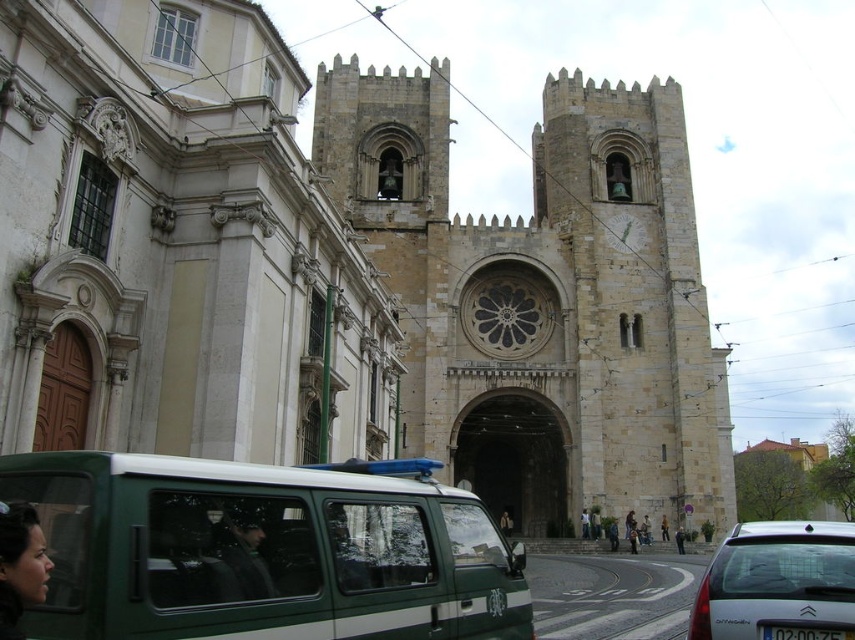
Question: Does green matte van at center appear on the left side of white glossy car at lower right?

Choices:
 (A) no
 (B) yes

Answer: (B)

Question: Among these points, which one is nearest to the camera?

Choices:
 (A) (186, 500)
 (B) (328, 316)

Answer: (A)

Question: Considering the real-world distances, which object is closest to the white glossy car at lower right?

Choices:
 (A) green matte van at center
 (B) beige stone church at center

Answer: (A)

Question: Which point is closer to the camera?

Choices:
 (A) white glossy car at lower right
 (B) beige stone church at center
 (C) green matte van at center

Answer: (C)

Question: Is green matte van at center positioned before white glossy car at lower right?

Choices:
 (A) yes
 (B) no

Answer: (A)

Question: Is green matte van at center bigger than white glossy car at lower right?

Choices:
 (A) yes
 (B) no

Answer: (B)